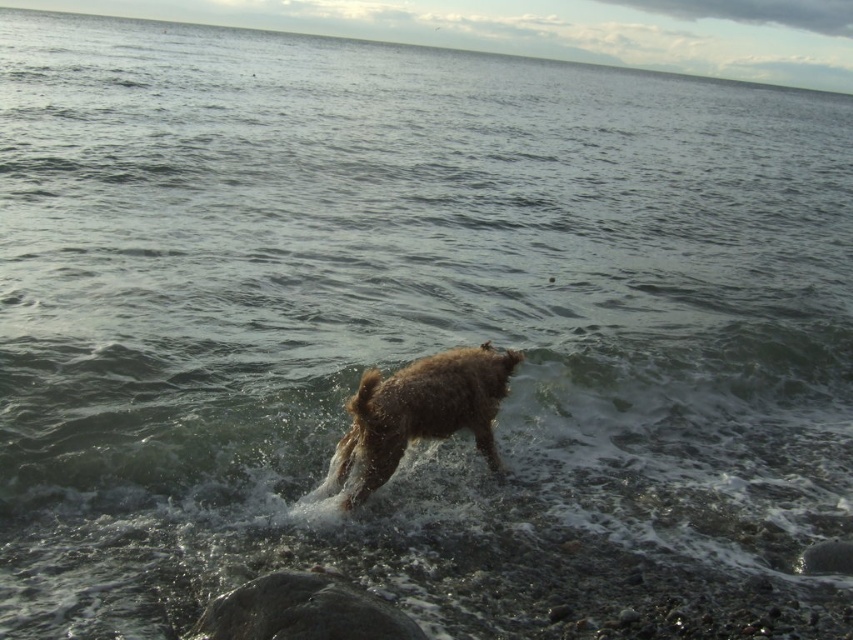
Consider the image. You are standing at the edge of the water and see two points marked on the dog. One is at point [477,381] and the other at point [241,584]. Which point is closer to you?

Point [477,381] is further to the viewer than point [241,584], so the point closer to you is point [241,584].

You are a photographer trying to capture the brown furry dog at center and the smooth gray rock at lower center in the same frame. Based on their sizes, which object would appear larger in your photo?

The brown furry dog at center would appear larger in the photo since it has a greater height compared to the smooth gray rock at lower center.

You are a photographer trying to capture the brown furry dog at center and the smooth gray rock at lower center in the same frame. Based on their positions, can you tell if the dog is jumping over the rock or landing on it?

The brown furry dog at center is positioned over smooth gray rock at lower center, indicating that the dog is jumping over the rock.